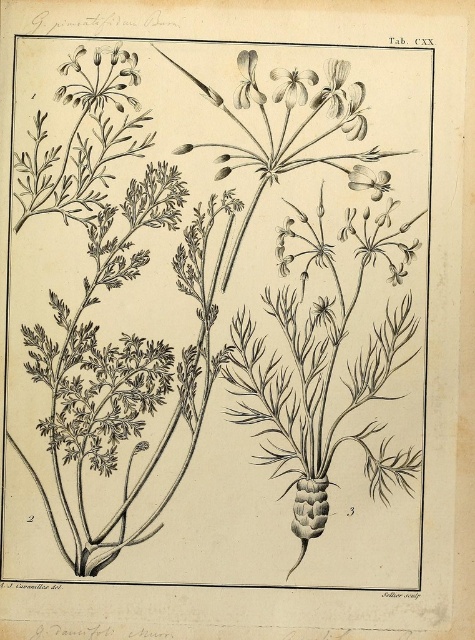
Question: Which of these objects is positioned farthest from the smooth white petal at upper center?

Choices:
 (A) smooth white flower at upper center
 (B) smooth white flower at upper right
 (C) white delicate petals at upper left

Answer: (C)

Question: From the image, what is the correct spatial relationship of smooth white flower at upper right in relation to white delicate petals at upper left?

Choices:
 (A) below
 (B) above

Answer: (A)

Question: Observing the image, what is the correct spatial positioning of smooth white petal at upper center in reference to white delicate petals at upper left?

Choices:
 (A) below
 (B) above

Answer: (A)

Question: Is smooth white flower at upper center positioned in front of white delicate petals at upper center?

Choices:
 (A) yes
 (B) no

Answer: (A)

Question: Which of the following is the farthest from the observer?

Choices:
 (A) smooth white petal at upper center
 (B) smooth white flower at upper right

Answer: (B)

Question: Based on their relative distances, which object is nearer to the smooth white flower at upper right?

Choices:
 (A) white delicate petals at upper left
 (B) smooth white petal at upper center
 (C) smooth white flower at upper center

Answer: (C)